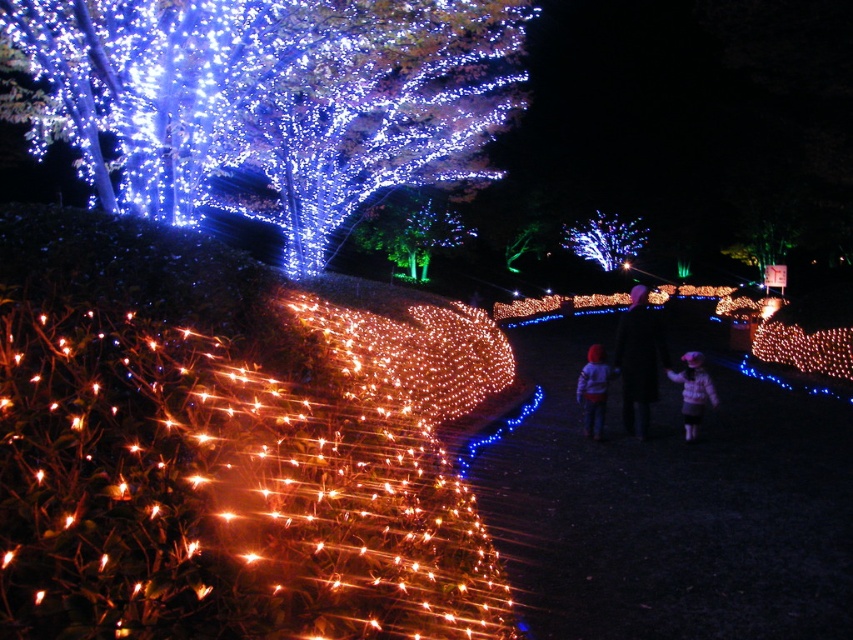
You are standing at the point marked by the coordinates point [605,240] in the image. Looking around, you see the illuminated wireframe tree at upper center. Based on your position, which direction would you face to look directly at the tree?

The point [605,240] indicates the illuminated wireframe tree at upper center, so you are already facing the tree directly.

You are standing at the entrance of a garden and see the illuminated plastic tree at upper left and the black fabric at center. Which object is positioned more to the left side of the garden?

The illuminated plastic tree at upper left is positioned more to the left side of the garden than the black fabric at center.